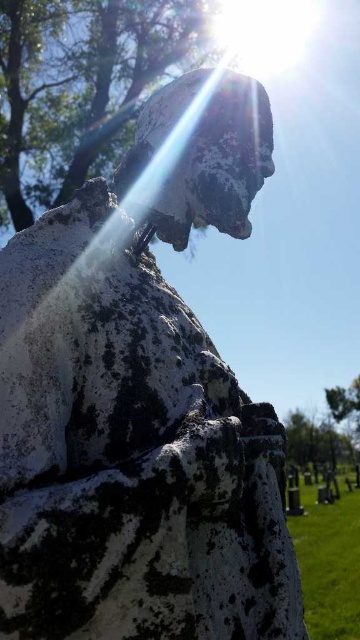
Is green leafy tree at upper center above green leafy tree at center?

Indeed, green leafy tree at upper center is positioned over green leafy tree at center.

Find the location of a particular element. This screenshot has height=640, width=360. green leafy tree at upper center is located at coordinates (79, 84).